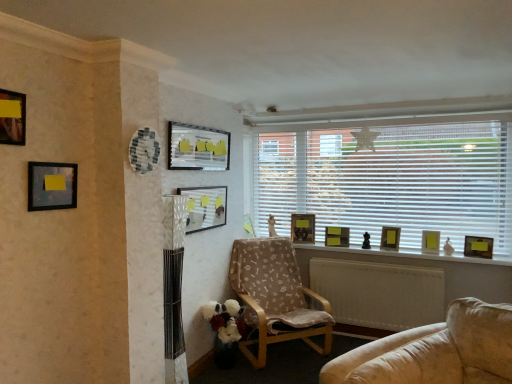
Question: Considering the relative sizes of wooden window sill at center and matte glass picture frame at center, arranged as the 4th picture frame when viewed from the front, in the image provided, is wooden window sill at center taller than matte glass picture frame at center, arranged as the 4th picture frame when viewed from the front,?

Choices:
 (A) yes
 (B) no

Answer: (B)

Question: From the image's perspective, is wooden window sill at center above matte glass picture frame at center, the 6th picture frame in the back-to-front sequence?

Choices:
 (A) yes
 (B) no

Answer: (B)

Question: Could you tell me if wooden window sill at center is facing matte glass picture frame at center, the 4th picture frame viewed from the left?

Choices:
 (A) yes
 (B) no

Answer: (B)

Question: Can you confirm if wooden window sill at center is positioned to the left of matte glass picture frame at center, the 6th picture frame in the back-to-front sequence?

Choices:
 (A) yes
 (B) no

Answer: (B)

Question: From the image's perspective, is wooden window sill at center located beneath matte glass picture frame at center, the 6th picture frame in the back-to-front sequence?

Choices:
 (A) no
 (B) yes

Answer: (B)

Question: Is yellow matte picture frame at window, which is the 7th picture frame in left-to-right order, inside the boundaries of matte black picture frame at upper left, placed as the ninth picture frame when sorted from back to front, or outside?

Choices:
 (A) inside
 (B) outside

Answer: (B)

Question: From a real-world perspective, is yellow matte picture frame at window, positioned as the third picture frame in back-to-front order, positioned above or below matte black picture frame at upper left, marked as the ninth picture frame in a right-to-left arrangement?

Choices:
 (A) below
 (B) above

Answer: (A)

Question: Is point (398, 238) closer or farther from the camera than point (23, 145)?

Choices:
 (A) closer
 (B) farther

Answer: (B)

Question: In the image, is yellow matte picture frame at window, positioned as the third picture frame in back-to-front order, on the left side or the right side of matte black picture frame at upper left, placed as the 1th picture frame when sorted from left to right?

Choices:
 (A) left
 (B) right

Answer: (B)

Question: Is point (75, 172) positioned closer to the camera than point (477, 253)?

Choices:
 (A) farther
 (B) closer

Answer: (B)

Question: In the image, is matte black picture frame at upper left, which appears as the eighth picture frame when viewed from the right, positioned in front of or behind wooden picture frame at right, which is counted as the fifth picture frame, starting from the back?

Choices:
 (A) front
 (B) behind

Answer: (A)

Question: Would you say matte black picture frame at upper left, which appears as the eighth picture frame when viewed from the right, is inside or outside wooden picture frame at right, placed as the 9th picture frame when sorted from left to right?

Choices:
 (A) outside
 (B) inside

Answer: (A)

Question: Considering the positions of matte black picture frame at upper left, which ranks as the 8th picture frame in back-to-front order, and wooden picture frame at right, arranged as the 1th picture frame when viewed from the right, in the image, is matte black picture frame at upper left, which ranks as the 8th picture frame in back-to-front order, bigger or smaller than wooden picture frame at right, arranged as the 1th picture frame when viewed from the right,?

Choices:
 (A) big
 (B) small

Answer: (A)

Question: Considering their positions, is wooden window sill at center located in front of or behind matte black picture frame at upper left, which appears as the eighth picture frame when viewed from the right?

Choices:
 (A) behind
 (B) front

Answer: (A)

Question: Is wooden window sill at center inside or outside of matte black picture frame at upper left, the second picture frame positioned from the left?

Choices:
 (A) inside
 (B) outside

Answer: (B)